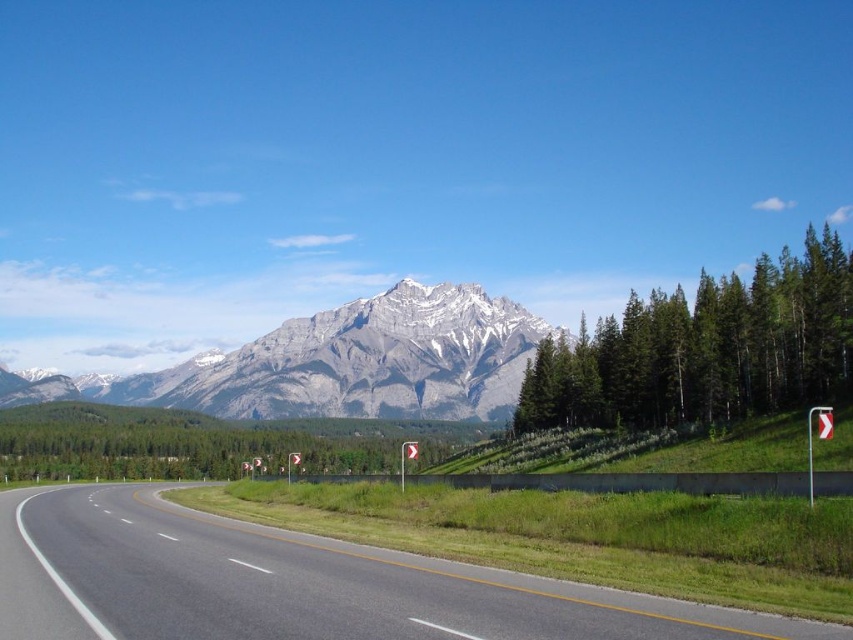
Does point (467, 394) lie in front of point (759, 289)?

No, (467, 394) is behind (759, 289).

Does gray rocky mountain at center have a larger size compared to green textured tree at center?

Yes, gray rocky mountain at center is bigger than green textured tree at center.

Which is in front, point (366, 390) or point (747, 339)?

Point (747, 339) is in front.

The height and width of the screenshot is (640, 853). Identify the location of gray rocky mountain at center. (341, 364).

Who is shorter, green textured tree at center or green leafy trees at center?

Standing shorter between the two is green leafy trees at center.

Between point (805, 388) and point (299, 451), which one is positioned behind?

Positioned behind is point (299, 451).

The image size is (853, 640). Identify the location of green textured tree at center. (705, 349).

Locate an element on the screen. green grass at lower right is located at coordinates (296, 582).

Who is taller, green grass at lower right or green textured tree at center?

green textured tree at center is taller.

Where is `green grass at lower right`? The width and height of the screenshot is (853, 640). green grass at lower right is located at coordinates (296, 582).